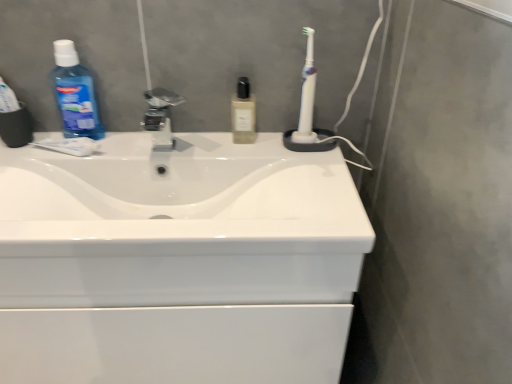
Image resolution: width=512 pixels, height=384 pixels. Find the location of `vacant area that is in front of white plastic toothbrush at upper right`. vacant area that is in front of white plastic toothbrush at upper right is located at coordinates (317, 170).